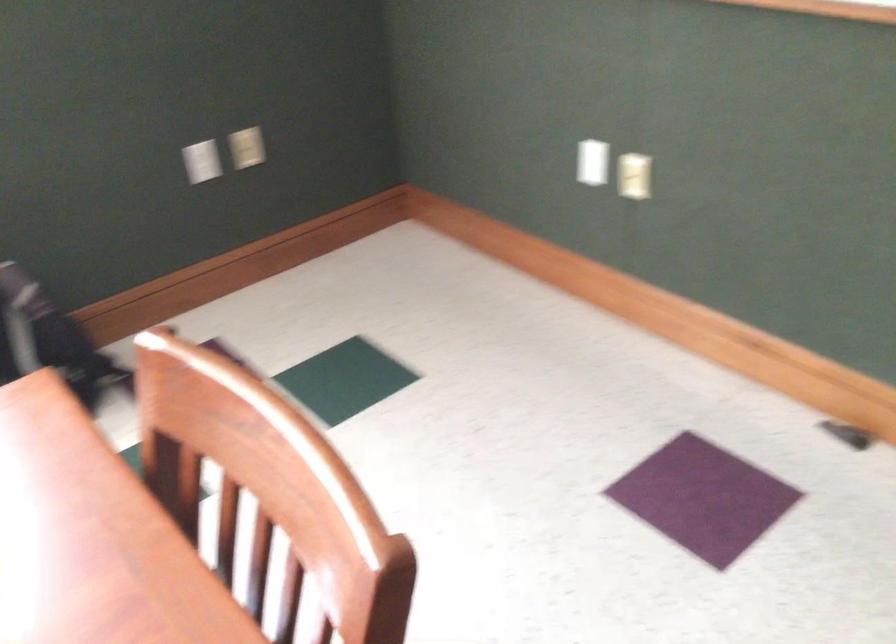
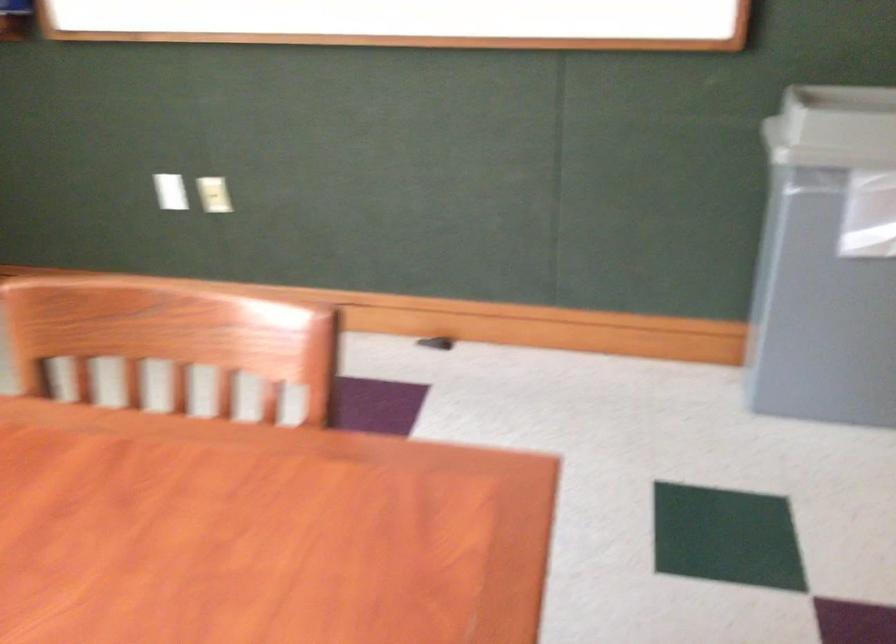
Question: The images are taken continuously from a first-person perspective. In which direction is your viewpoint rotating?

Choices:
 (A) Left
 (B) Right
 (C) Up
 (D) Down

Answer: (B)